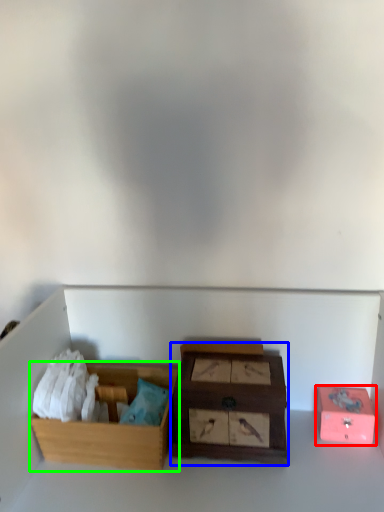
Question: Which is farther away from box (highlighted by a red box)? box (highlighted by a blue box) or box (highlighted by a green box)?

Choices:
 (A) box
 (B) box

Answer: (B)